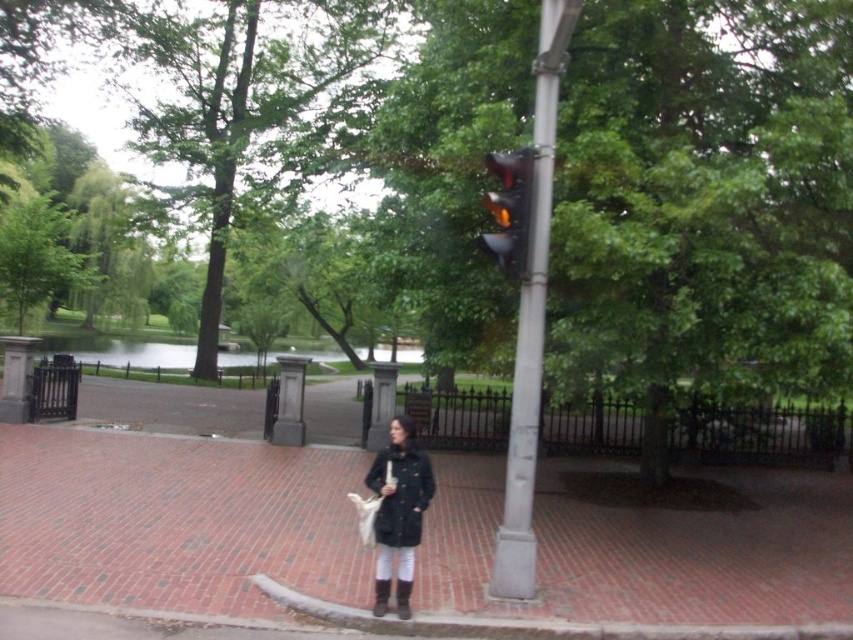
You are a delivery person carrying a package and need to place it on the ground near the matte black coat at center and the yellow glass traffic light at upper center. Which object should you place it closer to if you want it to be closer to both objects?

The matte black coat at center is 5.55 feet away from the yellow glass traffic light at upper center. To place the package closer to both, you should position it near the midpoint between them, which would be approximately 2.775 feet from each object.